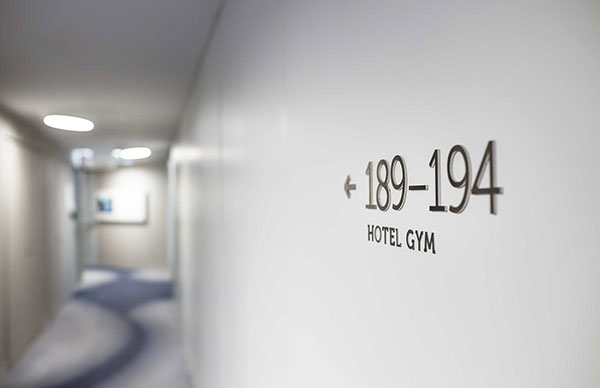
Find the location of a particular element. The height and width of the screenshot is (388, 600). room numbers is located at coordinates [381, 172].